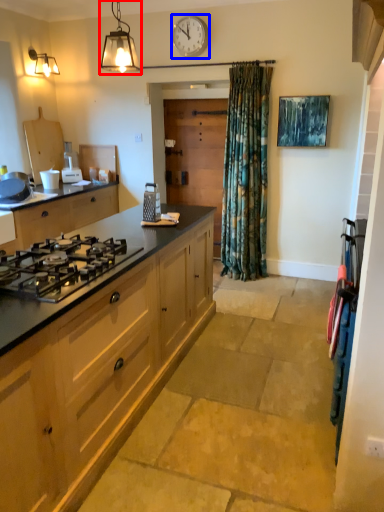
Question: Which object is further to the camera taking this photo, light fixture (highlighted by a red box) or clock (highlighted by a blue box)?

Choices:
 (A) light fixture
 (B) clock

Answer: (B)